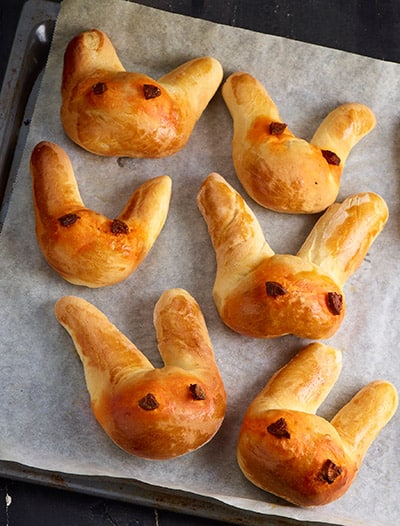
Where is `rim of tray`? This screenshot has width=400, height=526. rim of tray is located at coordinates pyautogui.click(x=107, y=491).